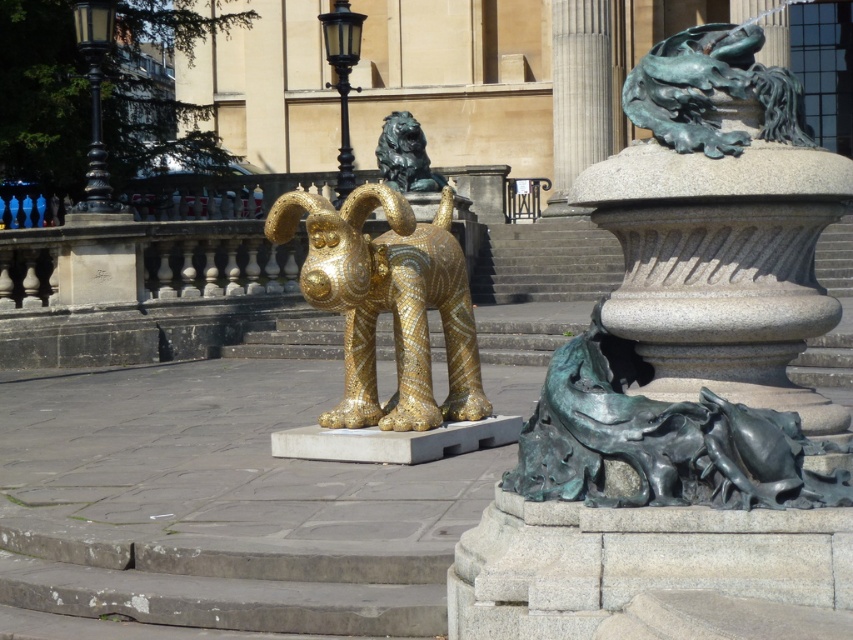
You are an art student standing in front of the gold mosaic ram at center and the green patina bronze dragon at upper right. Which sculpture is closer to you?

The gold mosaic ram at center is closer to you because it is further to the viewer than the green patina bronze dragon at upper right.